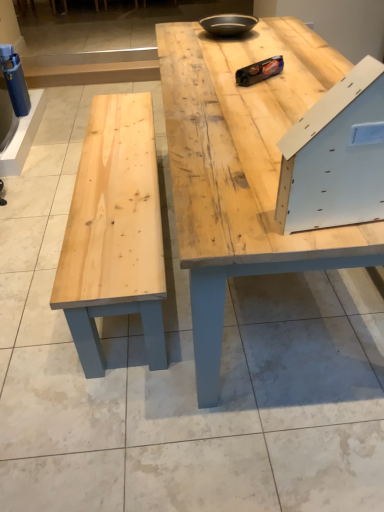
Find the location of a particular element. The width and height of the screenshot is (384, 512). vacant space in front of matte black bowl at upper center is located at coordinates (240, 47).